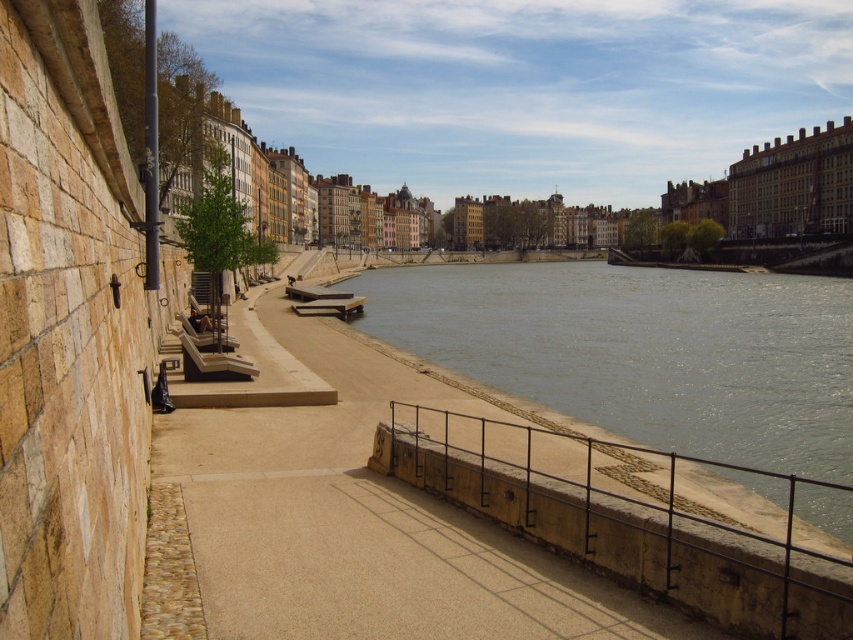
Is point (770, 314) closer to camera compared to point (312, 308)?

No.

Is smooth concrete river at center below wooden park bench at center?

Yes.

Does point (764, 496) lie behind point (315, 300)?

That is False.

You are a GUI agent. You are given a task and a screenshot of the screen. Output one action in this format:
    pyautogui.click(x=<x>, y=<y>)
    Task: Click on the smooth concrete river at center
    
    Given the screenshot: What is the action you would take?
    pyautogui.click(x=643, y=352)

Is wooden park bench at center positioned at the back of brown wooden bench at center?

No, it is in front of brown wooden bench at center.

Looking at this image, which of these two, wooden park bench at center or brown wooden bench at center, stands taller?

brown wooden bench at center

Is point (312, 301) closer to viewer compared to point (318, 298)?

Yes, point (312, 301) is closer to viewer.

Find the location of a particular element. wooden park bench at center is located at coordinates (329, 307).

Locate an element on the screen. The height and width of the screenshot is (640, 853). smooth concrete river at center is located at coordinates (643, 352).

Between smooth concrete river at center and brown wooden bench at center, which one has more height?

smooth concrete river at center

Identify the location of smooth concrete river at center. (643, 352).